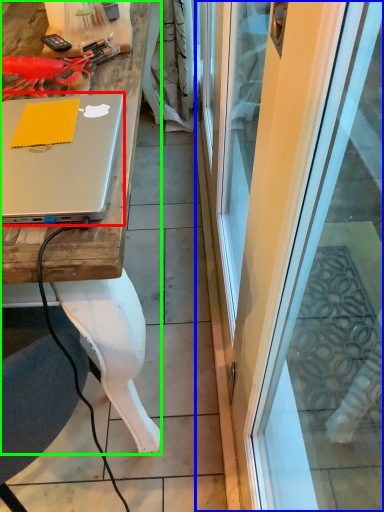
Question: Which object is the farthest from laptop (highlighted by a red box)? Choose among these: screen door (highlighted by a blue box) or desk (highlighted by a green box).

Choices:
 (A) screen door
 (B) desk

Answer: (A)